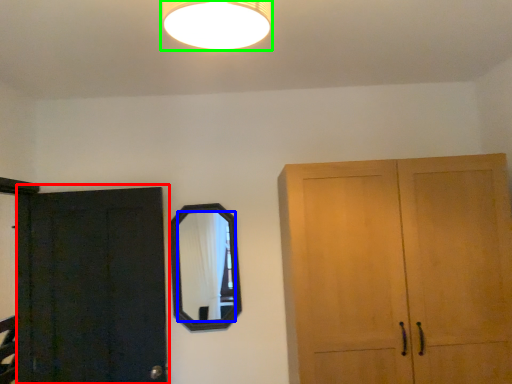
Question: Which object is the farthest from door (highlighted by a red box)? Choose among these: mirror (highlighted by a blue box) or lamp (highlighted by a green box).

Choices:
 (A) mirror
 (B) lamp

Answer: (B)